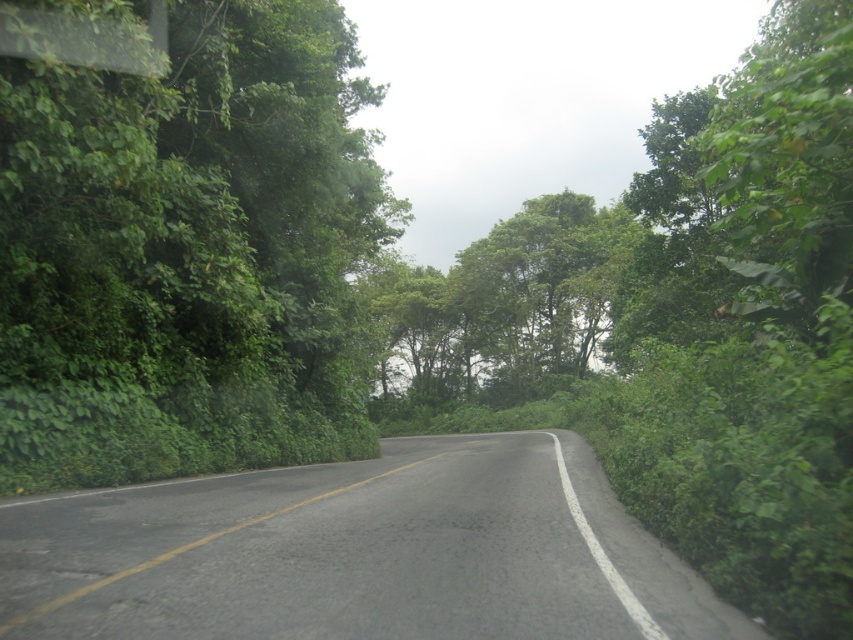
You are driving along the two lane road and see the green leafy tree at left and the green leafy tree at center. Which tree is closer to the left side of the road?

The green leafy tree at left is closer to the left side of the road because it is positioned to the left of the green leafy tree at center.